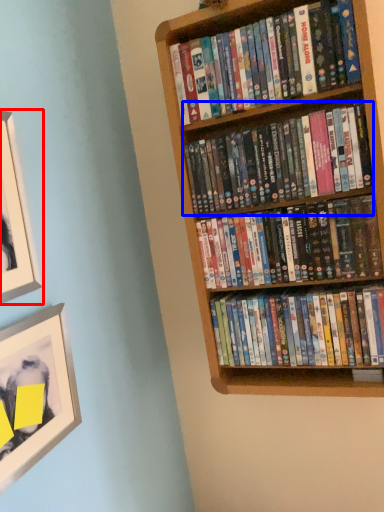
Question: Which object appears closest to the camera in this image, picture frame (highlighted by a red box) or book (highlighted by a blue box)?

Choices:
 (A) picture frame
 (B) book

Answer: (A)